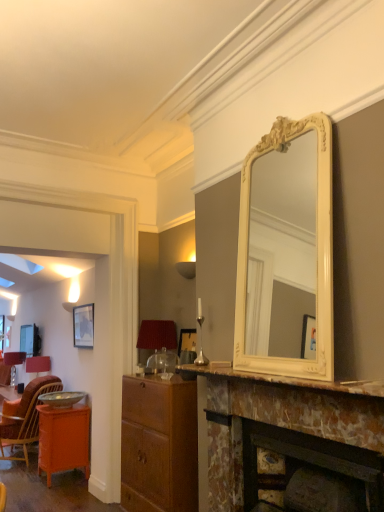
Question: Is orange wicker chair at lower left positioned behind orange glossy cabinet at lower left?

Choices:
 (A) yes
 (B) no

Answer: (A)

Question: Is orange glossy cabinet at lower left located within orange wicker chair at lower left?

Choices:
 (A) yes
 (B) no

Answer: (B)

Question: Is orange wicker chair at lower left facing towards orange glossy cabinet at lower left?

Choices:
 (A) yes
 (B) no

Answer: (B)

Question: From the image's perspective, is orange wicker chair at lower left on orange glossy cabinet at lower left?

Choices:
 (A) no
 (B) yes

Answer: (B)

Question: Is orange wicker chair at lower left not within orange glossy cabinet at lower left?

Choices:
 (A) no
 (B) yes

Answer: (B)

Question: Does orange wicker chair at lower left have a greater width compared to orange glossy cabinet at lower left?

Choices:
 (A) no
 (B) yes

Answer: (B)

Question: From the image's perspective, is wooden cabinet at center located above metallic silver bowl at lower left?

Choices:
 (A) yes
 (B) no

Answer: (A)

Question: Is wooden cabinet at center bigger than metallic silver bowl at lower left?

Choices:
 (A) yes
 (B) no

Answer: (A)

Question: Is wooden cabinet at center behind metallic silver bowl at lower left?

Choices:
 (A) yes
 (B) no

Answer: (B)

Question: From a real-world perspective, is wooden cabinet at center beneath metallic silver bowl at lower left?

Choices:
 (A) no
 (B) yes

Answer: (B)

Question: From a real-world perspective, is wooden cabinet at center physically above metallic silver bowl at lower left?

Choices:
 (A) no
 (B) yes

Answer: (A)

Question: Would you consider wooden cabinet at center to be distant from metallic silver bowl at lower left?

Choices:
 (A) no
 (B) yes

Answer: (B)

Question: Considering the relative sizes of matte red lampshade at left, the first lamp from the back, and wooden cabinet at center in the image provided, is matte red lampshade at left, the first lamp from the back, wider than wooden cabinet at center?

Choices:
 (A) no
 (B) yes

Answer: (A)